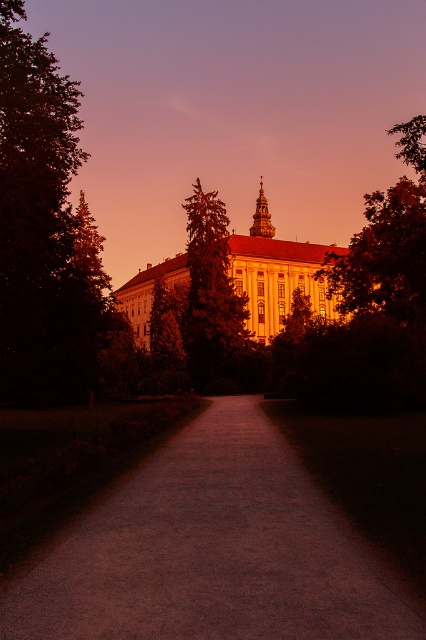
You are standing at the point marked by the coordinates point (209, 552) on the dusty gravel path at center. Looking towards the grand building, which direction should you walk to reach the building?

Since the point (209, 552) is on the dusty gravel path at center, which leads directly towards the grand building, you should continue walking forward along the path to reach the building.

You are standing on the pathway leading to the golden stone palace at center and the green leafy tree at center. Which object is closer to the ground?

The golden stone palace at center is closer to the ground because it is located below the green leafy tree at center.